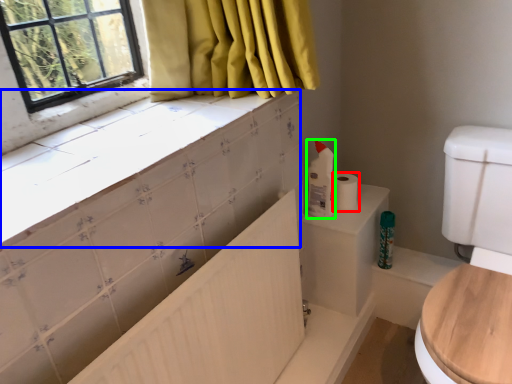
Question: Based on their relative distances, which object is nearer to toilet paper (highlighted by a red box)? Choose from counter top (highlighted by a blue box) and cleaning product (highlighted by a green box).

Choices:
 (A) counter top
 (B) cleaning product

Answer: (B)